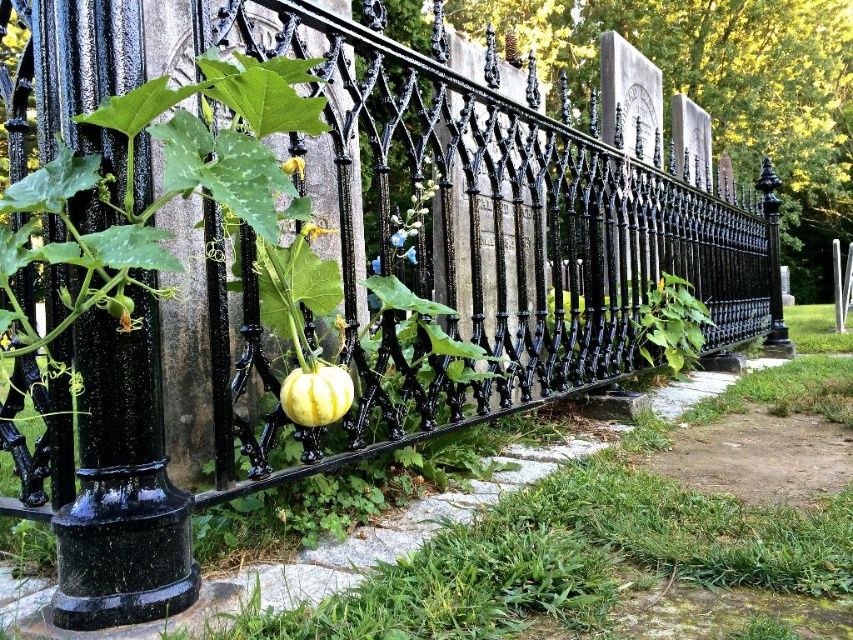
Question: Does yellow striped pumpkin at center have a larger size compared to yellow matte flower at center?

Choices:
 (A) yes
 (B) no

Answer: (A)

Question: Estimate the real-world distances between objects in this image. Which object is farther from the smooth yellow flower at center?

Choices:
 (A) yellow striped pumpkin at center
 (B) yellow matte flower at center

Answer: (A)

Question: Which object appears closest to the camera in this image?

Choices:
 (A) smooth yellow flower at center
 (B) yellow matte flower at center
 (C) yellow striped pumpkin at center

Answer: (C)

Question: Can you confirm if yellow striped pumpkin at center is wider than yellow matte flower at center?

Choices:
 (A) no
 (B) yes

Answer: (B)

Question: Can you confirm if yellow striped pumpkin at center is thinner than yellow matte flower at center?

Choices:
 (A) no
 (B) yes

Answer: (A)

Question: Which of the following is the closest to the observer?

Choices:
 (A) (300, 176)
 (B) (310, 220)
 (C) (299, 380)

Answer: (C)